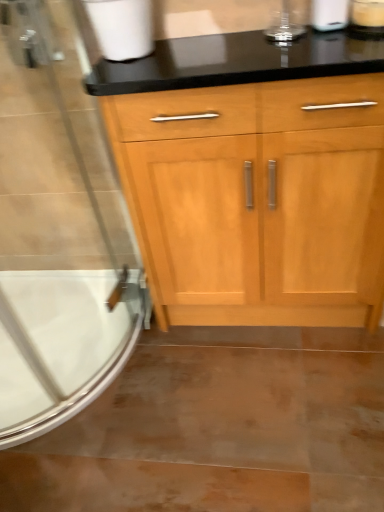
Question: Can you confirm if white matte toilet paper at upper left, the first toilet paper from the left, is smaller than white matte toilet paper at upper right, acting as the first toilet paper starting from the right?

Choices:
 (A) no
 (B) yes

Answer: (A)

Question: From the image's perspective, is white matte toilet paper at upper left, the first toilet paper from the left, located above white matte toilet paper at upper right, placed as the 2th toilet paper when sorted from left to right?

Choices:
 (A) no
 (B) yes

Answer: (A)

Question: Is white matte toilet paper at upper left, the first toilet paper from the left, not inside white matte toilet paper at upper right, acting as the first toilet paper starting from the right?

Choices:
 (A) no
 (B) yes

Answer: (B)

Question: Is white matte toilet paper at upper left, the first toilet paper from the left, thinner than white matte toilet paper at upper right, placed as the 2th toilet paper when sorted from left to right?

Choices:
 (A) no
 (B) yes

Answer: (A)

Question: Does white matte toilet paper at upper left, the first toilet paper from the left, have a lesser height compared to white matte toilet paper at upper right, acting as the first toilet paper starting from the right?

Choices:
 (A) no
 (B) yes

Answer: (B)

Question: Is clear glass screen door at left bigger or smaller than white glossy bathtub at lower left?

Choices:
 (A) small
 (B) big

Answer: (B)

Question: From a real-world perspective, is clear glass screen door at left positioned above or below white glossy bathtub at lower left?

Choices:
 (A) below
 (B) above

Answer: (B)

Question: Is clear glass screen door at left taller or shorter than white glossy bathtub at lower left?

Choices:
 (A) tall
 (B) short

Answer: (A)

Question: Is clear glass screen door at left to the left or to the right of white glossy bathtub at lower left in the image?

Choices:
 (A) left
 (B) right

Answer: (B)

Question: Considering the relative positions of white glossy bathtub at lower left and white matte toilet paper at upper left, the first toilet paper from the left, in the image provided, is white glossy bathtub at lower left to the left or to the right of white matte toilet paper at upper left, the first toilet paper from the left,?

Choices:
 (A) left
 (B) right

Answer: (A)

Question: Considering their positions, is white glossy bathtub at lower left located in front of or behind white matte toilet paper at upper left, the second toilet paper positioned from the right?

Choices:
 (A) front
 (B) behind

Answer: (B)

Question: Considering the positions of white glossy bathtub at lower left and white matte toilet paper at upper left, the first toilet paper from the left, in the image, is white glossy bathtub at lower left bigger or smaller than white matte toilet paper at upper left, the first toilet paper from the left,?

Choices:
 (A) big
 (B) small

Answer: (A)

Question: Considering the positions of white glossy bathtub at lower left and white matte toilet paper at upper left, the first toilet paper from the left, in the image, is white glossy bathtub at lower left taller or shorter than white matte toilet paper at upper left, the first toilet paper from the left,?

Choices:
 (A) short
 (B) tall

Answer: (A)

Question: In the image, is white matte toilet paper at upper left, the first toilet paper from the left, positioned in front of or behind satin nickel faucet at upper left?

Choices:
 (A) front
 (B) behind

Answer: (A)

Question: Based on their sizes in the image, would you say white matte toilet paper at upper left, the first toilet paper from the left, is bigger or smaller than satin nickel faucet at upper left?

Choices:
 (A) small
 (B) big

Answer: (B)